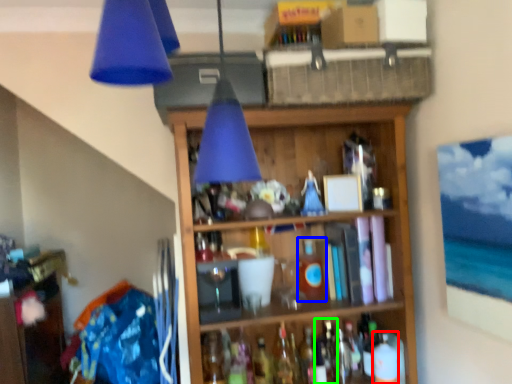
Question: Estimate the real-world distances between objects in this image. Which object is farther from bottle (highlighted by a red box), bottle (highlighted by a blue box) or bottle (highlighted by a green box)?

Choices:
 (A) bottle
 (B) bottle

Answer: (A)